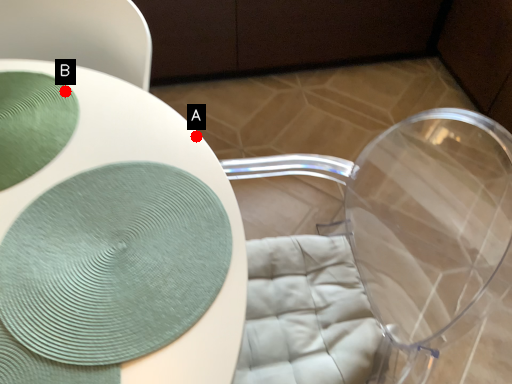
Question: Two points are circled on the image, labeled by A and B beside each circle. Which point appears closest to the camera in this image?

Choices:
 (A) A is closer
 (B) B is closer

Answer: (A)